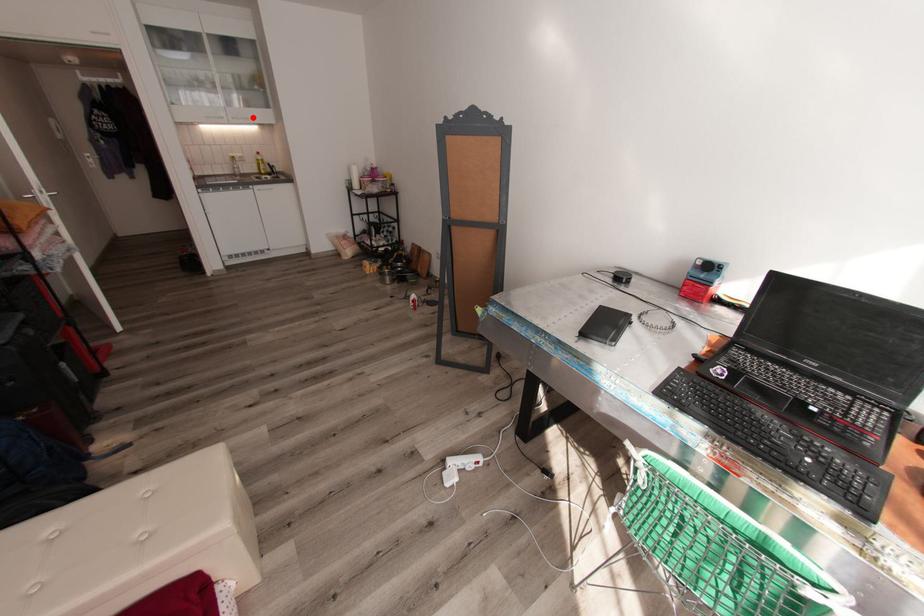
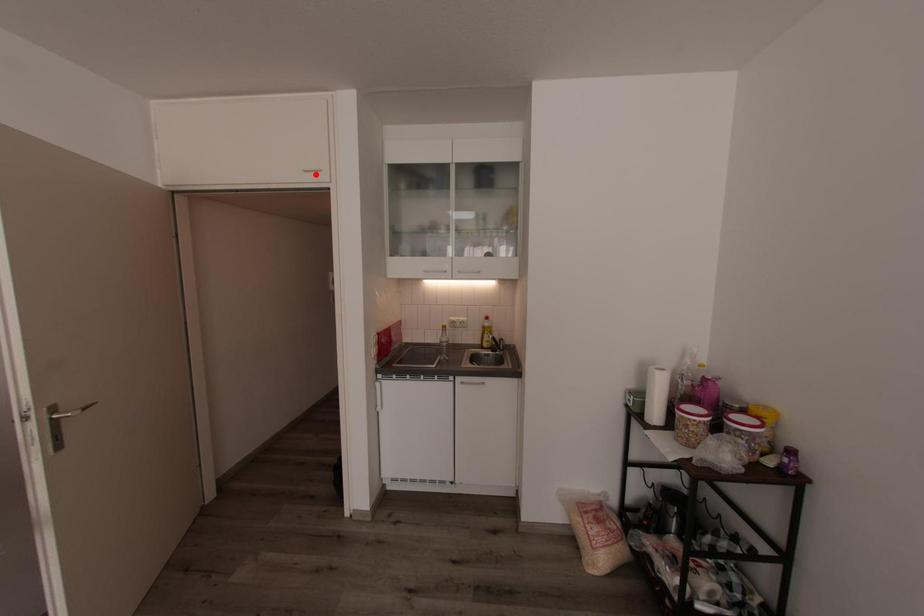
I am providing you with two images of the same scene from different viewpoints. A red point is marked on the first image and another point is marked on the second image. Is the red point in image1 aligned with the point shown in image2?

No